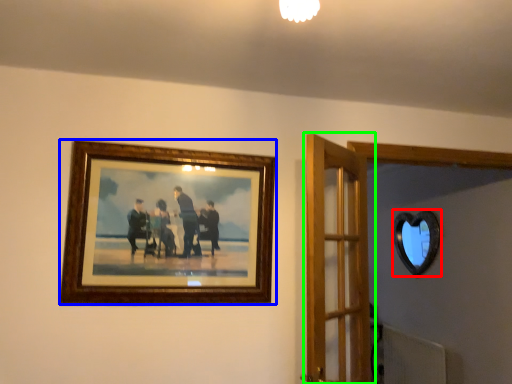
Question: Based on their relative distances, which object is farther from mirror (highlighted by a red box)? Choose from picture frame (highlighted by a blue box) and door (highlighted by a green box).

Choices:
 (A) picture frame
 (B) door

Answer: (A)